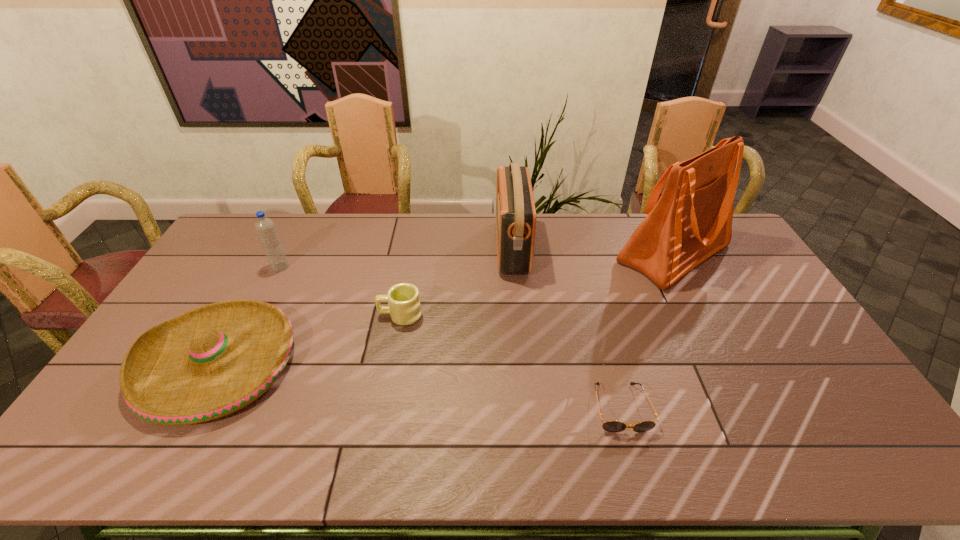
Identify the location of radio receiver present at the far edge. (515, 208).

Locate an element on the screen. sombrero present at the near edge is located at coordinates point(211,361).

At what (x,y) coordinates should I click in order to perform the action: click on sunglasses positioned at the near edge. Please return your answer as a coordinate pair (x, y). The width and height of the screenshot is (960, 540). Looking at the image, I should click on (611, 426).

Where is `object situated at the left edge`? Image resolution: width=960 pixels, height=540 pixels. object situated at the left edge is located at coordinates (211, 361).

The image size is (960, 540). Identify the location of object that is at the right edge. (692, 220).

Find the location of `object that is at the near left corner`. object that is at the near left corner is located at coordinates (211, 361).

At what (x,y) coordinates should I click in order to perform the action: click on object that is at the far right corner. Please return your answer as a coordinate pair (x, y). The image size is (960, 540). Looking at the image, I should click on pyautogui.click(x=692, y=220).

Where is `vacant area at the far edge`? The image size is (960, 540). vacant area at the far edge is located at coordinates (638, 217).

This screenshot has height=540, width=960. Identify the location of vacant space at the near edge of the desktop. (294, 464).

Locate an element on the screen. Image resolution: width=960 pixels, height=540 pixels. vacant region at the right edge of the desktop is located at coordinates (771, 343).